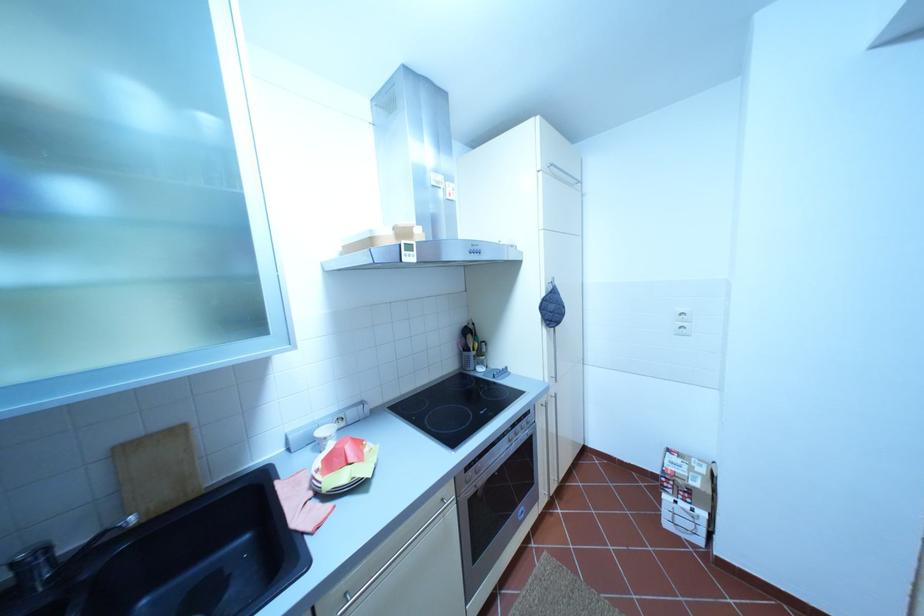
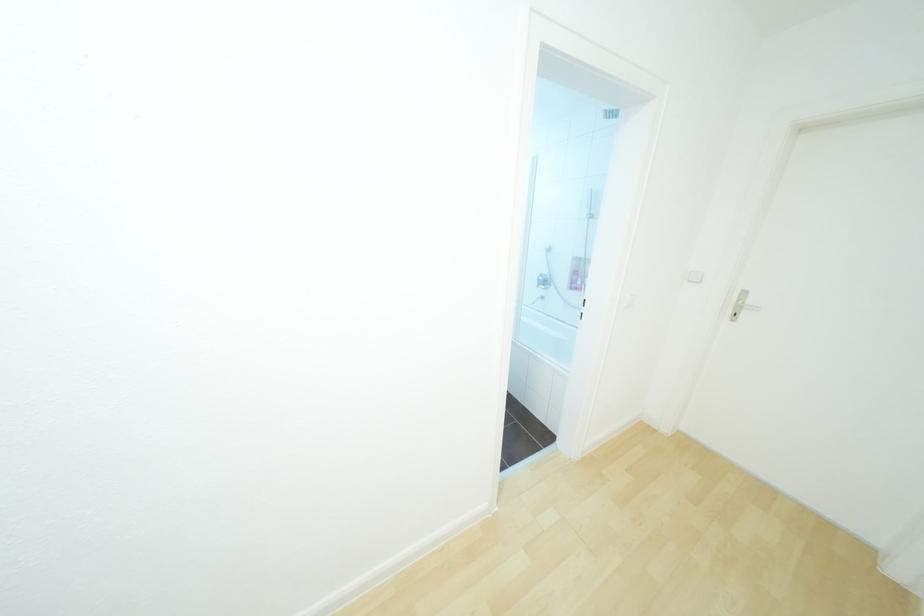
Question: I am providing you with two images of the same scene from different viewpoints. Please identify which objects are invisible in image2.

Choices:
 (A) brown mug handle
 (B) pink bottle
 (C) blue oven mitt
 (D) silver door handle

Answer: (C)